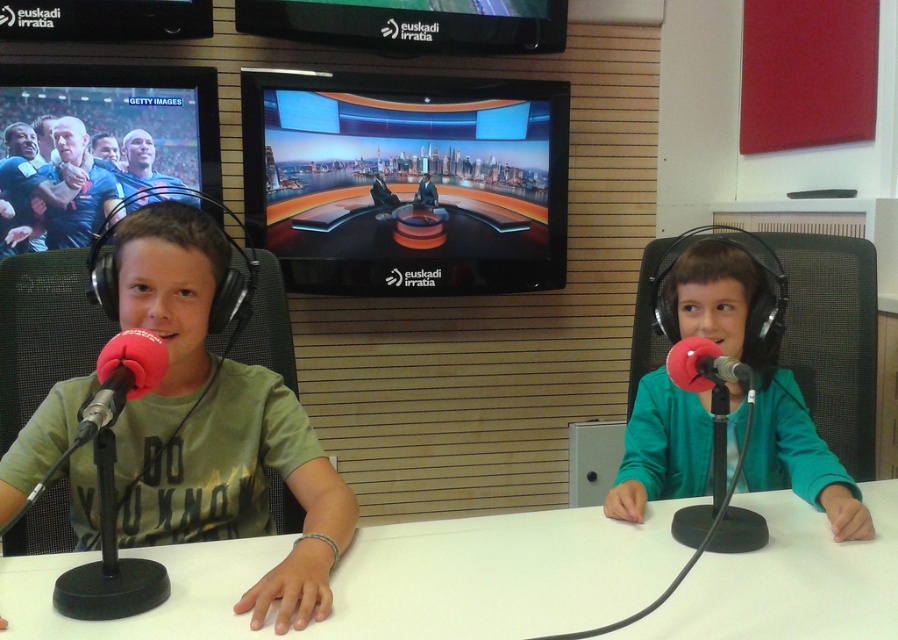
Does white matte table at center appear on the left side of red foam microphone at left?

Incorrect, white matte table at center is not on the left side of red foam microphone at left.

Is point (781, 593) positioned before point (164, 365)?

No.

Which is in front, point (822, 561) or point (137, 381)?

Point (137, 381) is in front.

Identify the location of white matte table at center. pyautogui.click(x=500, y=573).

Does red foam microphone at left appear under red foam microphone at right?

Correct, red foam microphone at left is located below red foam microphone at right.

Is red foam microphone at left shorter than red foam microphone at right?

In fact, red foam microphone at left may be taller than red foam microphone at right.

Which is in front, point (155, 362) or point (694, 381)?

Point (155, 362)

The image size is (898, 640). Find the location of `red foam microphone at left`. red foam microphone at left is located at coordinates (122, 378).

Between green matte jacket at right and red foam microphone at right, which one has less height?

Standing shorter between the two is red foam microphone at right.

Is point (781, 484) positioned in front of point (703, 339)?

That is False.

Image resolution: width=898 pixels, height=640 pixels. What are the coordinates of `green matte jacket at right` in the screenshot? It's located at (762, 384).